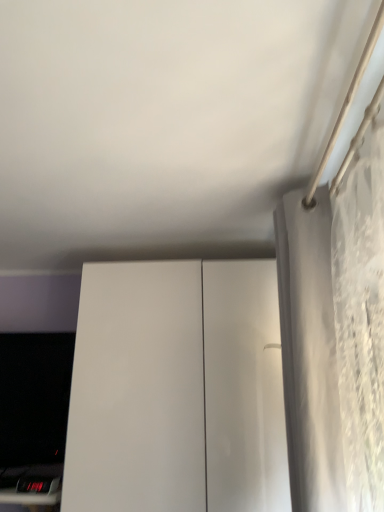
Question: Looking at the image, does white textured curtain at right seem bigger or smaller compared to black glossy computer monitor at lower left?

Choices:
 (A) big
 (B) small

Answer: (A)

Question: Choose the correct answer: Is white textured curtain at right inside black glossy computer monitor at lower left or outside it?

Choices:
 (A) inside
 (B) outside

Answer: (B)

Question: Considering the real-world distances, which object is farthest from the black glossy computer monitor at lower left?

Choices:
 (A) white glossy cabinet at center
 (B) white textured curtain at right

Answer: (B)

Question: Which is farther from the black glossy computer monitor at lower left?

Choices:
 (A) white glossy cabinet at center
 (B) white textured curtain at right

Answer: (B)